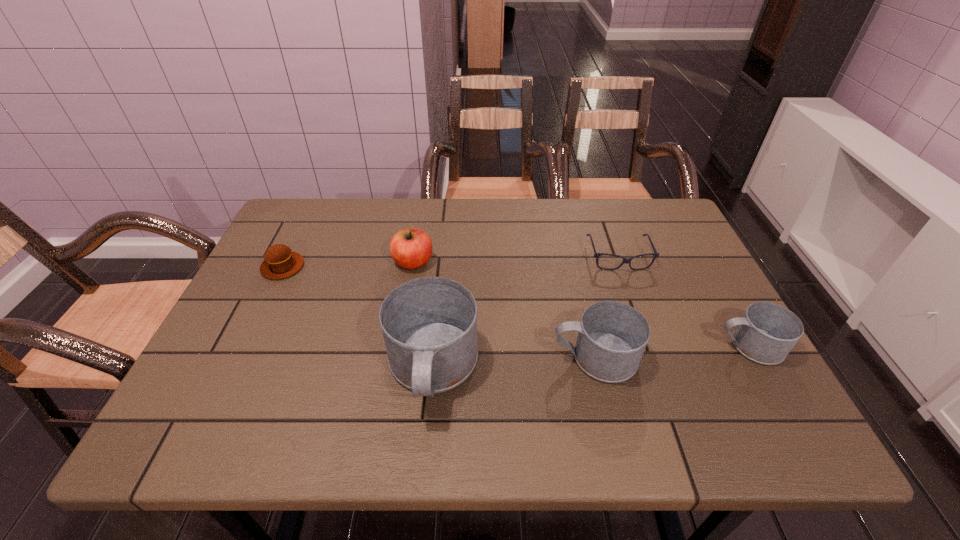
Image resolution: width=960 pixels, height=540 pixels. I want to click on free region located 0.270m on the side of the second mug from left to right with the handle, so pos(429,357).

This screenshot has height=540, width=960. What are the coordinates of `free region located 0.230m on the side of the rightmost object with the handle` in the screenshot? It's located at (613, 346).

Locate an element on the screen. vacant area located on the side of the rightmost object with the handle is located at coordinates (547, 346).

Locate an element on the screen. The image size is (960, 540). free region located on the side of the rightmost object with the handle is located at coordinates (591, 346).

Locate an element on the screen. The width and height of the screenshot is (960, 540). vacant region located 0.360m on the right of the apple is located at coordinates (565, 262).

The height and width of the screenshot is (540, 960). I want to click on vacant area situated 0.350m on the front-facing side of the spectacles, so click(665, 388).

At what (x,y) coordinates should I click in order to perform the action: click on vacant space located 0.160m on the back of the leftmost object. Please return your answer as a coordinate pair (x, y). This screenshot has width=960, height=540. Looking at the image, I should click on (306, 220).

The height and width of the screenshot is (540, 960). In order to click on object located at the far edge in this screenshot , I will do `click(596, 255)`.

The width and height of the screenshot is (960, 540). What are the coordinates of `object present at the left edge` in the screenshot? It's located at click(280, 262).

I want to click on mug that is at the right edge, so click(767, 332).